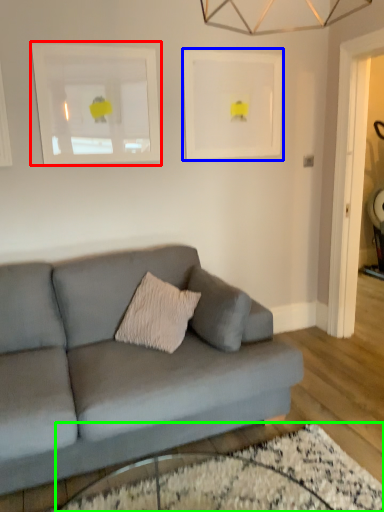
Question: Which is nearer to the picture frame (highlighted by a red box)? picture frame (highlighted by a blue box) or glass table (highlighted by a green box).

Choices:
 (A) picture frame
 (B) glass table

Answer: (A)